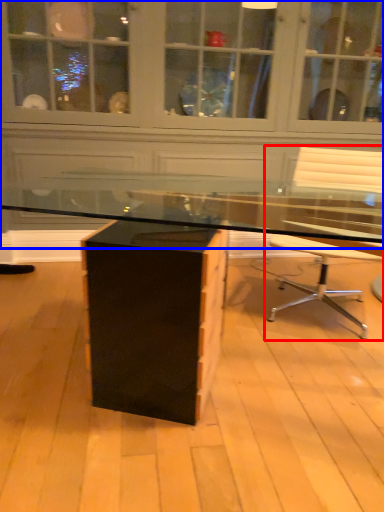
Question: Which of the following is the farthest to the observer, chair (highlighted by a red box) or dresser (highlighted by a blue box)?

Choices:
 (A) chair
 (B) dresser

Answer: (B)